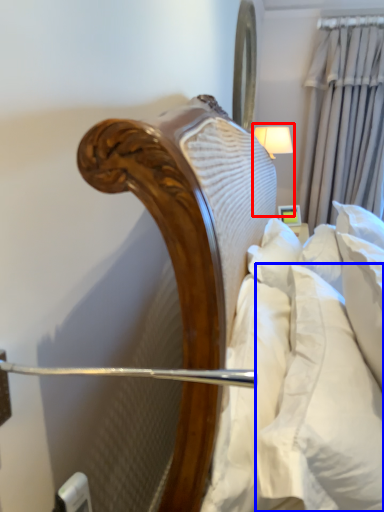
Question: Which of the following is the closest to the observer, bedside lamp (highlighted by a red box) or pillow (highlighted by a blue box)?

Choices:
 (A) bedside lamp
 (B) pillow

Answer: (B)